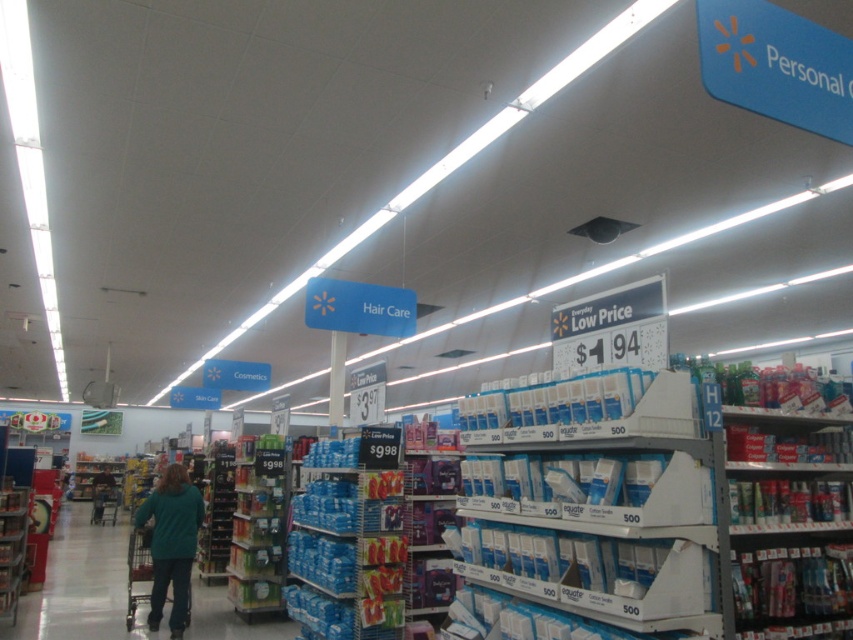
Between point (413, 321) and point (9, 532), which one is positioned behind?

Positioned behind is point (413, 321).

Measure the distance from blue plastic sign at upper center to blue plastic shelf at lower left.

The distance of blue plastic sign at upper center from blue plastic shelf at lower left is 12.16 feet.

Is point (335, 282) more distant than point (0, 541)?

Yes, point (335, 282) is farther from viewer.

In order to click on blue plastic sign at upper center in this screenshot , I will do `click(358, 307)`.

Can you confirm if white cardboard boxes at center is smaller than blue plastic shelf at lower left?

Incorrect, white cardboard boxes at center is not smaller in size than blue plastic shelf at lower left.

Which of these two, white cardboard boxes at center or blue plastic shelf at lower left, stands shorter?

white cardboard boxes at center

Describe the element at coordinates (589, 506) in the screenshot. I see `white cardboard boxes at center` at that location.

Image resolution: width=853 pixels, height=640 pixels. Identify the location of white cardboard boxes at center. (589, 506).

Can you confirm if white cardboard boxes at center is smaller than blue plastic sign at upper center?

Incorrect, white cardboard boxes at center is not smaller in size than blue plastic sign at upper center.

Is point (606, 520) positioned in front of point (404, 333)?

Yes, point (606, 520) is in front of point (404, 333).

Is point (463, 600) less distant than point (386, 333)?

Yes, it is.

Identify the location of white cardboard boxes at center. Image resolution: width=853 pixels, height=640 pixels. (589, 506).